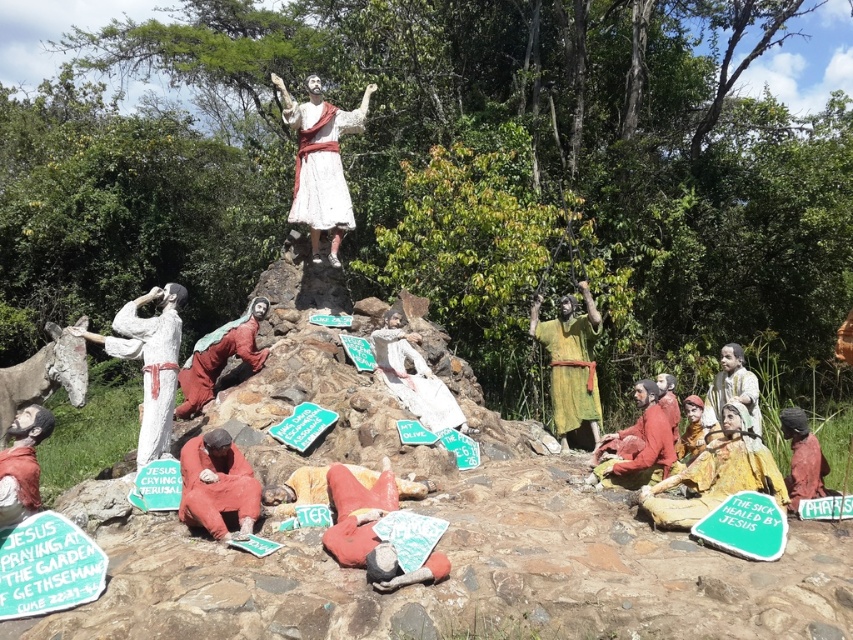
Question: Among these points, which one is farthest from the camera?

Choices:
 (A) (310, 483)
 (B) (798, 461)
 (C) (334, 248)
 (D) (651, 422)

Answer: (C)

Question: Does white matte statue at upper center have a larger size compared to matte brown statue at lower left?

Choices:
 (A) no
 (B) yes

Answer: (B)

Question: Which point is farther to the camera?

Choices:
 (A) matte red robe at center
 (B) terracotta clay figure at lower center

Answer: (A)

Question: Based on their relative distances, which object is farther from the green fabric figure at center?

Choices:
 (A) white painted statue at left
 (B) matte red statue at lower center
 (C) white matte statue at upper center
 (D) red fabric figure at lower right

Answer: (A)

Question: Can you confirm if matte red statue at lower center is wider than matte gold statue at lower right?

Choices:
 (A) no
 (B) yes

Answer: (B)

Question: Is terracotta clay figure at lower center thinner than matte red robe at center?

Choices:
 (A) no
 (B) yes

Answer: (B)